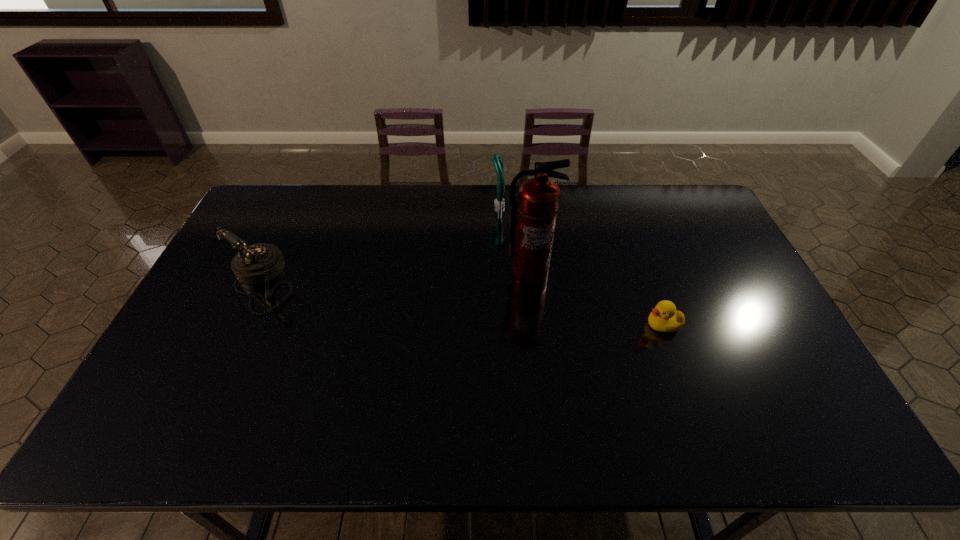
Locate an element on the screen. Image resolution: width=960 pixels, height=540 pixels. blank space at the right edge is located at coordinates (724, 272).

At what (x,y) coordinates should I click in order to perform the action: click on vacant space at the near left corner of the desktop. Please return your answer as a coordinate pair (x, y). Looking at the image, I should click on (152, 437).

The width and height of the screenshot is (960, 540). I want to click on vacant area that lies between the rightmost object and the leftmost object, so click(462, 303).

I want to click on free space that is in between the leftmost object and the duck, so click(462, 303).

Where is `free space between the tallest object and the duck`? The height and width of the screenshot is (540, 960). free space between the tallest object and the duck is located at coordinates (596, 299).

This screenshot has height=540, width=960. I want to click on free space between the duck and the fire extinguisher, so click(596, 299).

Locate an element on the screen. free spot between the rightmost object and the telephone is located at coordinates (462, 303).

The width and height of the screenshot is (960, 540). Find the location of `free spot between the leftmost object and the fire extinguisher`. free spot between the leftmost object and the fire extinguisher is located at coordinates (396, 278).

Find the location of a particular element. This screenshot has width=960, height=540. empty location between the duck and the second shortest object is located at coordinates (462, 303).

At what (x,y) coordinates should I click in order to perform the action: click on free space between the shortest object and the farthest object. Please return your answer as a coordinate pair (x, y). The width and height of the screenshot is (960, 540). Looking at the image, I should click on (580, 265).